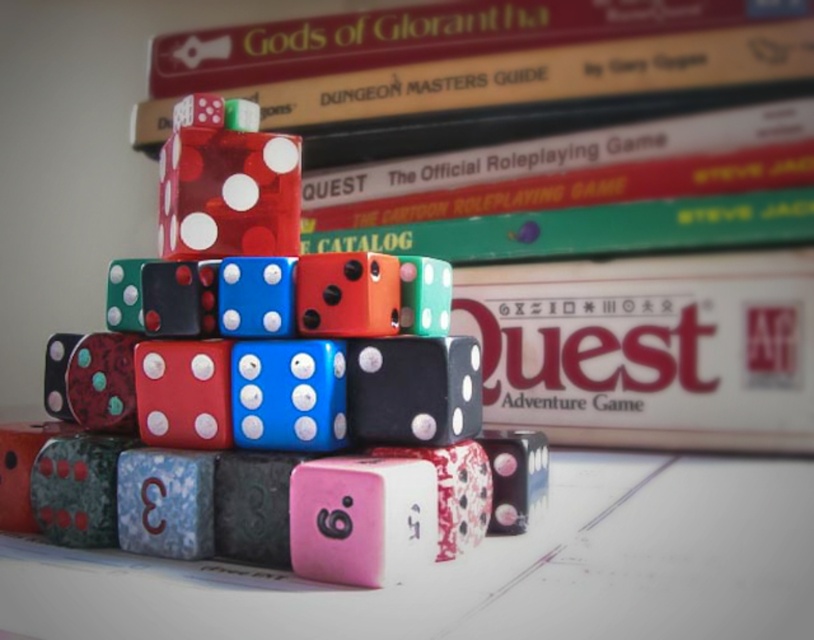
Looking at this image, who is taller, shiny plastic dice at center or translucent red dice at center?

shiny plastic dice at center

Does shiny plastic dice at center appear over translucent red dice at center?

Actually, shiny plastic dice at center is below translucent red dice at center.

From the picture: Who is more distant from viewer, [524,465] or [248,218]?

The point [248,218] is behind.

Locate an element on the screen. This screenshot has height=640, width=814. shiny plastic dice at center is located at coordinates (274, 420).

Does matte plastic quest adventure game at center appear under translucent red dice at center?

Correct, matte plastic quest adventure game at center is located below translucent red dice at center.

Which is in front, point (637, 264) or point (261, 230)?

Point (261, 230) is more forward.

Locate an element on the screen. The height and width of the screenshot is (640, 814). matte plastic quest adventure game at center is located at coordinates (648, 348).

Is hardcover book at center positioned before translucent red dice at center?

No, it is not.

Who is more forward, (528, 394) or (195, 131)?

Point (195, 131)

Locate an element on the screen. The height and width of the screenshot is (640, 814). hardcover book at center is located at coordinates (511, 100).